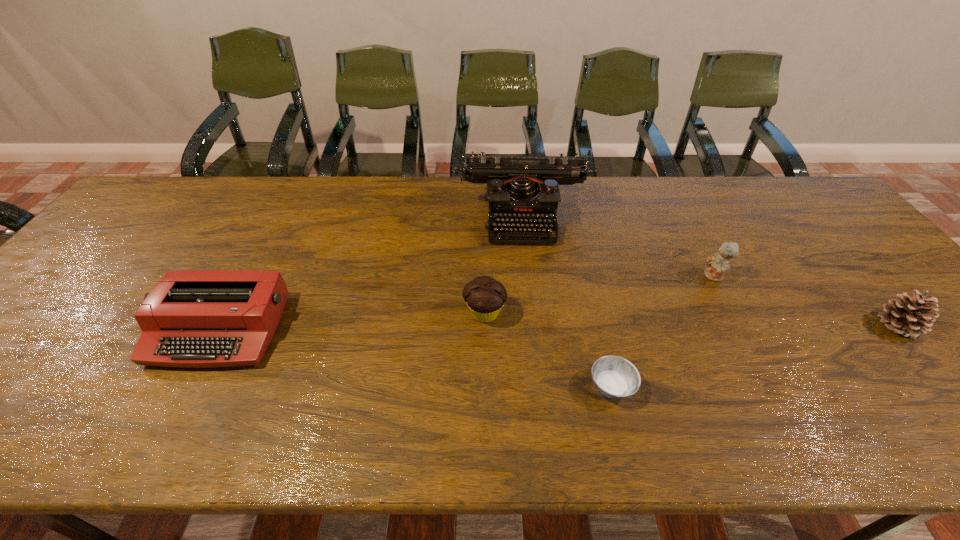
In the image, there is a desktop. Find the location of `vacant space at the far edge`. vacant space at the far edge is located at coordinates (604, 191).

Find the location of a particular element. The image size is (960, 540). vacant space at the near edge of the desktop is located at coordinates (599, 448).

Where is `vacant region at the left edge of the desktop`? Image resolution: width=960 pixels, height=540 pixels. vacant region at the left edge of the desktop is located at coordinates (149, 232).

Find the location of a particular element. This screenshot has width=960, height=540. vacant space at the right edge of the desktop is located at coordinates (895, 347).

Image resolution: width=960 pixels, height=540 pixels. I want to click on free space at the far left corner of the desktop, so click(x=162, y=186).

You are a GUI agent. You are given a task and a screenshot of the screen. Output one action in this format:
    pyautogui.click(x=<x>, y=<y>)
    Task: Click on the free space at the far right corner of the desktop
    Image resolution: width=960 pixels, height=540 pixels.
    Given the screenshot: What is the action you would take?
    pyautogui.click(x=794, y=191)

Where is `empty location between the pinecone and the nearer typewriter`? The width and height of the screenshot is (960, 540). empty location between the pinecone and the nearer typewriter is located at coordinates (559, 328).

Identify the location of unoccupied position between the muffin and the farther typewriter. The height and width of the screenshot is (540, 960). (504, 265).

This screenshot has width=960, height=540. Find the location of `unoccupied position between the rightmost object and the shorter typewriter`. unoccupied position between the rightmost object and the shorter typewriter is located at coordinates (559, 328).

I want to click on blank region between the right typewriter and the fifth nearest object, so click(619, 246).